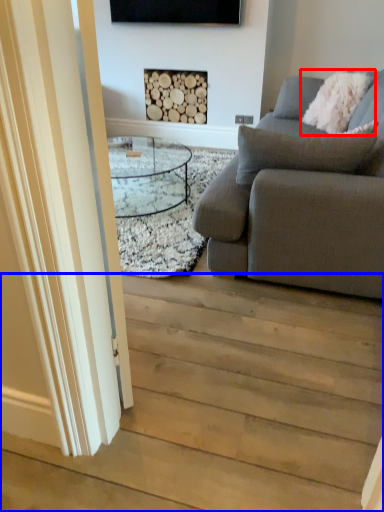
Question: Which point is further to the camera, pillow (highlighted by a red box) or stairwell (highlighted by a blue box)?

Choices:
 (A) pillow
 (B) stairwell

Answer: (A)